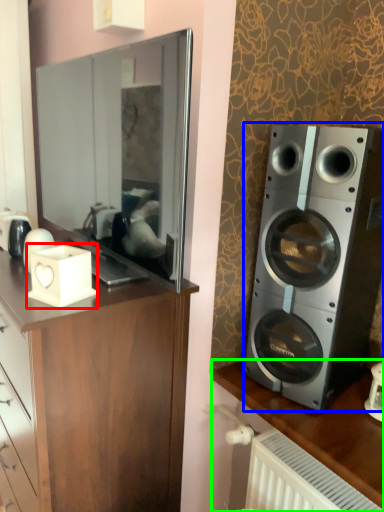
Question: Based on their relative distances, which object is nearer to appliance (highlighted by a red box)? Choose from speaker (highlighted by a blue box) and desk (highlighted by a green box).

Choices:
 (A) speaker
 (B) desk

Answer: (A)